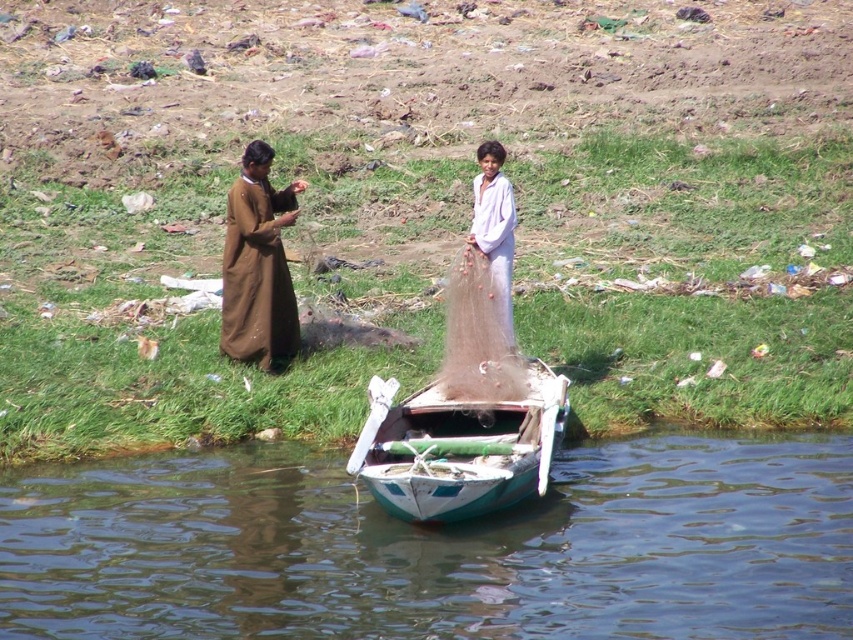
Question: Does brown matte robe at upper left appear over white matte net at center?

Choices:
 (A) yes
 (B) no

Answer: (A)

Question: Which point is farther to the camera?

Choices:
 (A) smooth green water at lower center
 (B) white matte net at center
 (C) teal wooden boat at center

Answer: (B)

Question: Which point is farther from the camera taking this photo?

Choices:
 (A) (267, 269)
 (B) (549, 464)
 (C) (173, 600)
 (D) (496, 257)

Answer: (A)

Question: Does teal wooden boat at center come behind white matte net at center?

Choices:
 (A) yes
 (B) no

Answer: (B)

Question: Is smooth green water at lower center closer to camera compared to white matte net at center?

Choices:
 (A) no
 (B) yes

Answer: (B)

Question: Among these objects, which one is farthest from the camera?

Choices:
 (A) brown matte robe at upper left
 (B) white matte net at center
 (C) smooth green water at lower center
 (D) teal wooden boat at center

Answer: (A)